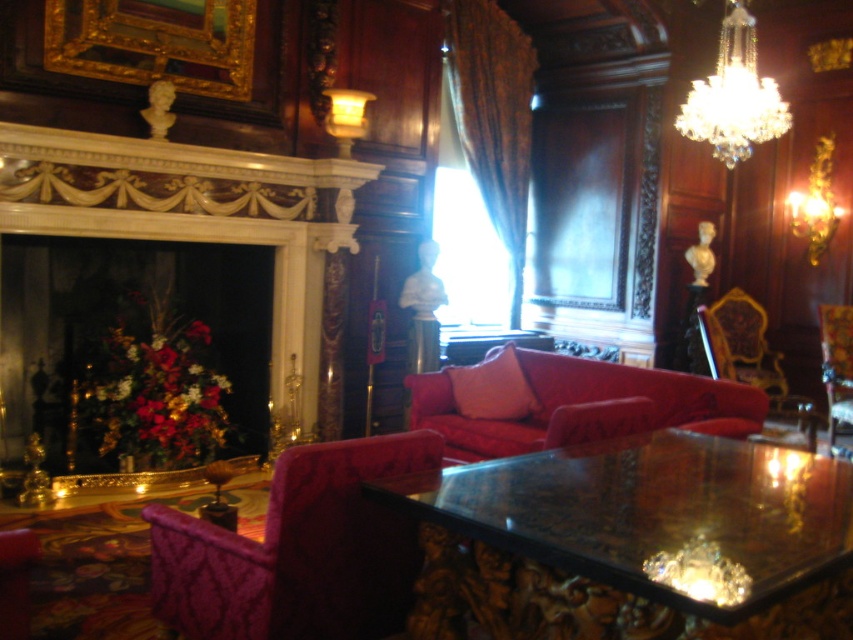
Question: Which of the following is the farthest from the observer?

Choices:
 (A) clear crystal chandelier at upper right
 (B) velvet chair at right
 (C) white marble fireplace at left

Answer: (B)

Question: Which point appears closest to the camera in this image?

Choices:
 (A) (422, 538)
 (B) (827, 340)
 (C) (39, 193)
 (D) (114, 24)

Answer: (A)

Question: Is the position of white marble fireplace at left less distant than that of velvet red couch at center?

Choices:
 (A) yes
 (B) no

Answer: (B)

Question: Is white marble fireplace at left further to camera compared to clear crystal chandelier at upper right?

Choices:
 (A) no
 (B) yes

Answer: (A)

Question: Can you confirm if velvet purple chair at lower left is positioned above goldmetallicpicture frame at upper left?

Choices:
 (A) yes
 (B) no

Answer: (B)

Question: Among these objects, which one is nearest to the camera?

Choices:
 (A) goldmetallicpicture frame at upper left
 (B) shiny glass table at center
 (C) velvet red couch at center

Answer: (B)